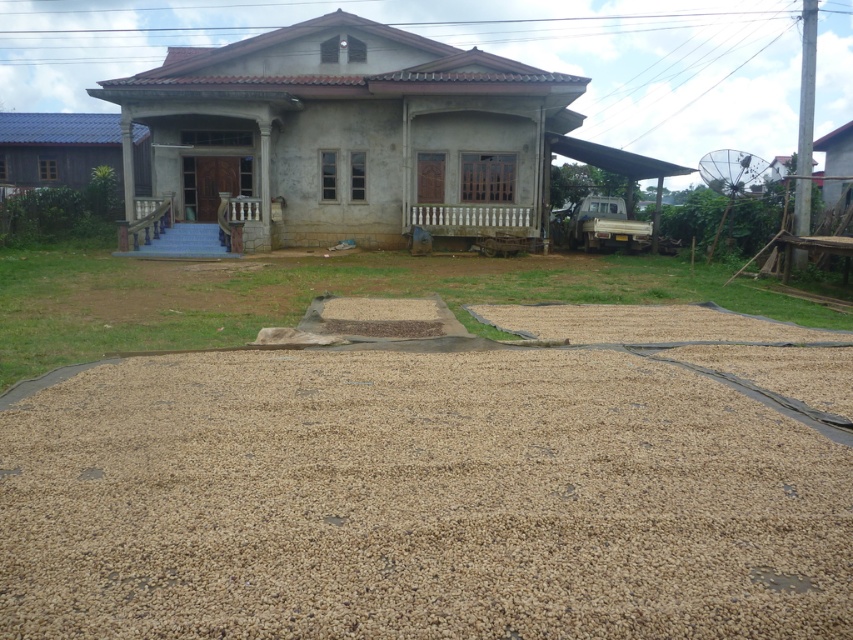
Can you confirm if light brown gravel at center is positioned to the right of brown gravel at center?

Correct, you'll find light brown gravel at center to the right of brown gravel at center.

Between point (747, 394) and point (634, 301), which one is positioned behind?

The point (634, 301) is more distant.

This screenshot has width=853, height=640. I want to click on light brown gravel at center, so click(440, 484).